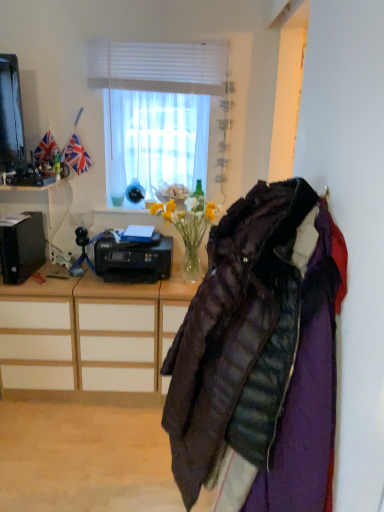
Question: Visually, is black plastic printer at left, the 2th desk ordered from the bottom, positioned to the left or to the right of quilted dark brown jacket at right?

Choices:
 (A) right
 (B) left

Answer: (B)

Question: From a real-world perspective, is black plastic printer at left, which ranks as the first desk in top-to-bottom order, above or below quilted dark brown jacket at right?

Choices:
 (A) above
 (B) below

Answer: (A)

Question: Which object is the farthest from the wooden drawer at center?

Choices:
 (A) black plastic printer at center
 (B) white matte window at upper center
 (C) quilted dark brown jacket at right
 (D) wooden desk at left, the 2th desk viewed from the top
 (E) black plastic printer at left, which ranks as the first desk in top-to-bottom order

Answer: (B)

Question: Which object is positioned farthest from the wooden desk at left, the first desk when ordered from bottom to top?

Choices:
 (A) black plastic printer at center
 (B) wooden drawer at center
 (C) black plastic printer at left, which ranks as the first desk in top-to-bottom order
 (D) white matte window at upper center
 (E) quilted dark brown jacket at right

Answer: (D)